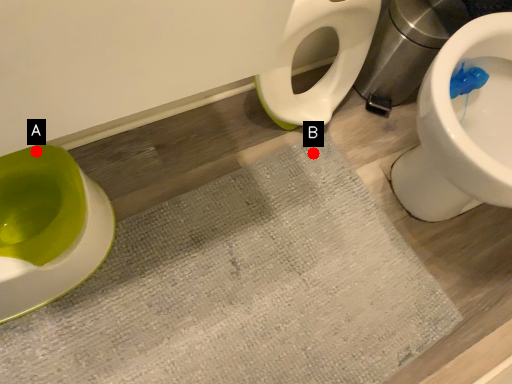
Question: Two points are circled on the image, labeled by A and B beside each circle. Which of the following is the closest to the observer?

Choices:
 (A) A is closer
 (B) B is closer

Answer: (A)